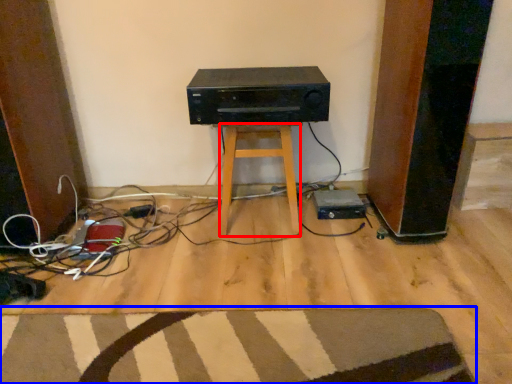
Question: Among these objects, which one is nearest to the camera, stool (highlighted by a red box) or doormat (highlighted by a blue box)?

Choices:
 (A) stool
 (B) doormat

Answer: (B)